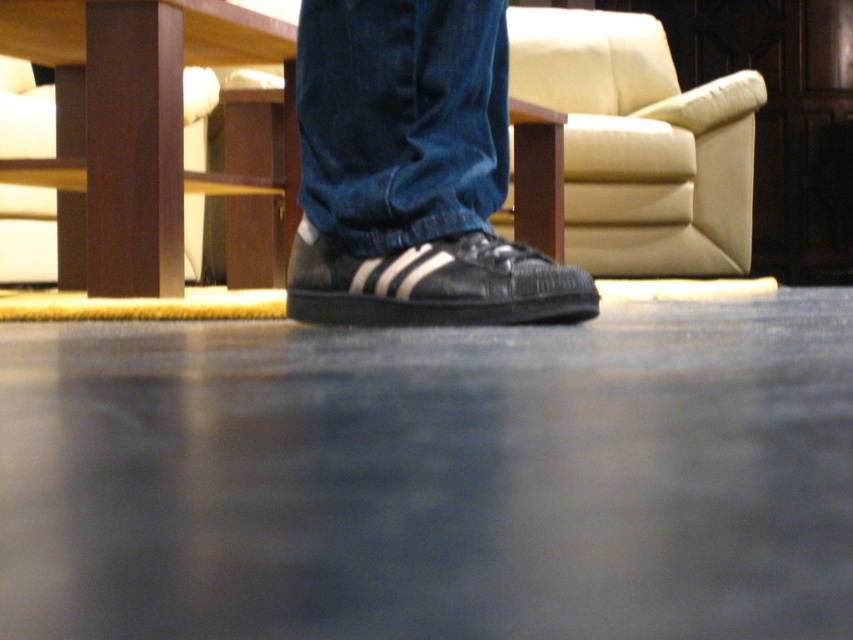
How distant is brown wood stool at lower left from denim at center?

brown wood stool at lower left is 33.97 inches from denim at center.

Is brown wood stool at lower left above denim at center?

Correct, brown wood stool at lower left is located above denim at center.

The width and height of the screenshot is (853, 640). Describe the element at coordinates (134, 128) in the screenshot. I see `brown wood stool at lower left` at that location.

At what (x,y) coordinates should I click in order to perform the action: click on brown wood stool at lower left. Please return your answer as a coordinate pair (x, y). Looking at the image, I should click on (134, 128).

Is denim at center in front of black leather shoe at center?

That is False.

Is point (439, 113) positioned in front of point (424, 296)?

No, it is behind (424, 296).

Identify the location of denim at center. click(x=401, y=118).

Consider the image. Is denim at center bigger than beige leather armchair at upper center?

No, denim at center is not bigger than beige leather armchair at upper center.

Is denim at center closer to the viewer compared to beige leather armchair at upper center?

Yes.

Between point (386, 145) and point (608, 20), which one is positioned in front?

Point (386, 145) is in front.

At what (x,y) coordinates should I click in order to perform the action: click on denim at center. Please return your answer as a coordinate pair (x, y). The height and width of the screenshot is (640, 853). Looking at the image, I should click on (401, 118).